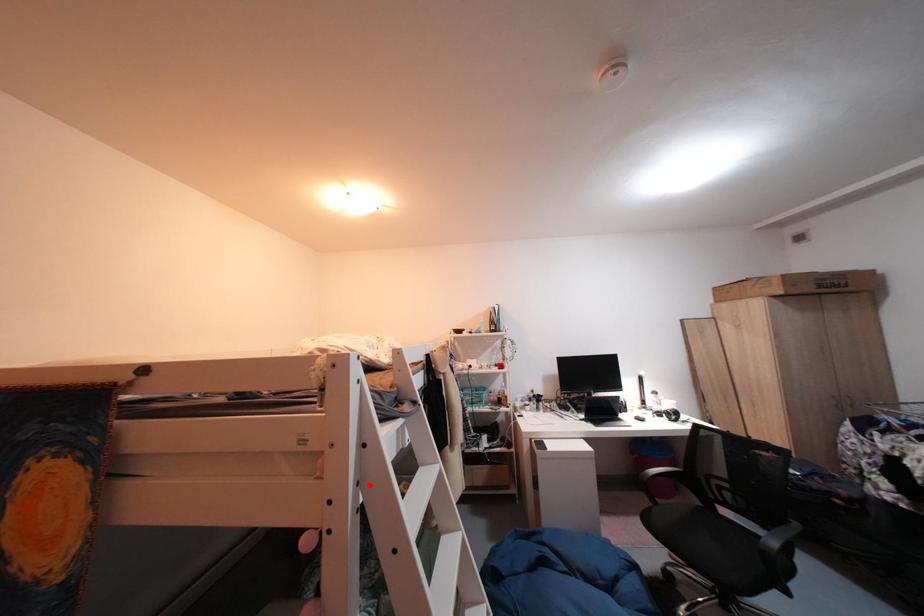
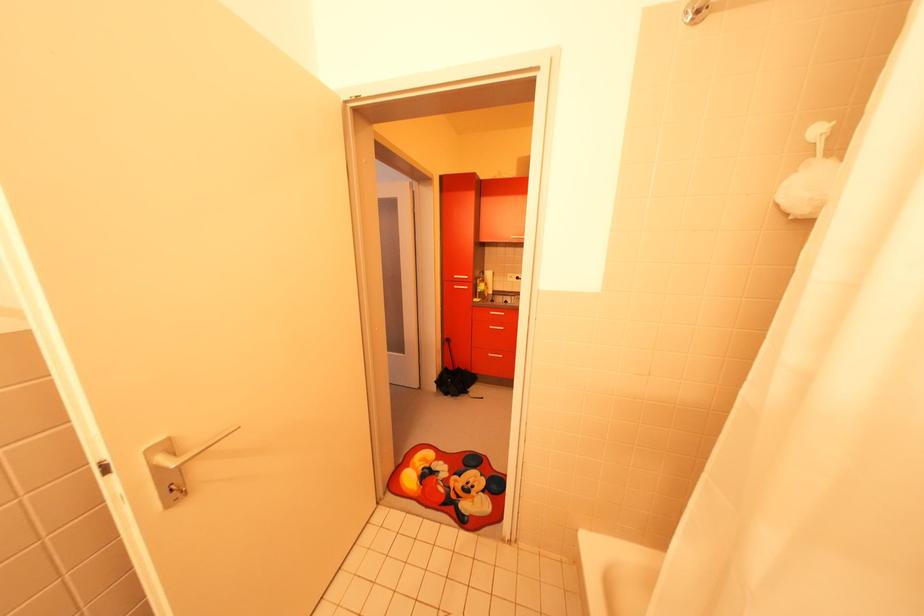
Question: I am providing you with two images of the same scene from different viewpoints. A red point is marked on the first image. Can you still see the location of the red point in image 2?

Choices:
 (A) Yes
 (B) No

Answer: (B)